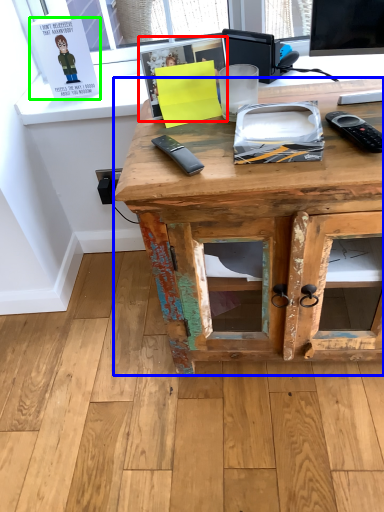
Question: Which is nearer to the book (highlighted by a red box)? desk (highlighted by a blue box) or book (highlighted by a green box).

Choices:
 (A) desk
 (B) book

Answer: (A)